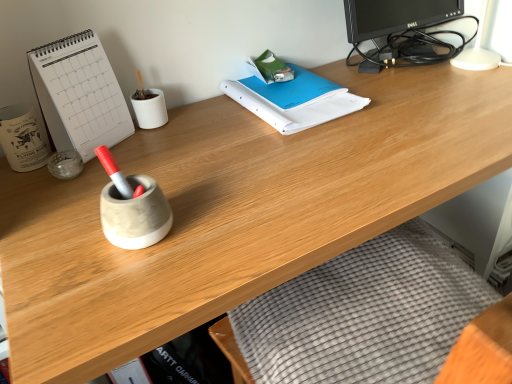
Identify the location of black glossy monitor at upper right. (401, 31).

This screenshot has height=384, width=512. What do you see at coordinates (401, 31) in the screenshot?
I see `black glossy monitor at upper right` at bounding box center [401, 31].

What is the approximate width of white paper at left?

white paper at left is 3.40 inches wide.

What is the approximate width of white ceramic mug at left, which appears as the second stationery when viewed from the right?

4.03 inches.

This screenshot has width=512, height=384. I want to click on blue paper binder at center, so click(294, 100).

Locate an element on the screen. This screenshot has height=384, width=512. black glossy monitor at upper right is located at coordinates pyautogui.click(x=401, y=31).

From a real-world perspective, which is physically above, transparent glass jar at left, arranged as the 1th stationery when viewed from the right, or blue paper binder at center?

From a 3D spatial view, blue paper binder at center is above.

You are a GUI agent. You are given a task and a screenshot of the screen. Output one action in this format:
    pyautogui.click(x=<x>, y=<y>)
    Task: Click on the 1st stationery to the left of the blue paper binder at center, counting from the anchor's position
    This screenshot has height=384, width=512.
    Given the screenshot: What is the action you would take?
    pyautogui.click(x=65, y=164)

From the image's perspective, which is below, transparent glass jar at left, arranged as the 1th stationery when viewed from the right, or blue paper binder at center?

transparent glass jar at left, arranged as the 1th stationery when viewed from the right.

Is transparent glass jar at left, arranged as the 1th stationery when viewed from the right, touching blue paper binder at center?

They are not placed beside each other.

Measure the distance between black glossy monitor at upper right and blue paper binder at center.

The distance of black glossy monitor at upper right from blue paper binder at center is 11.90 inches.

Is the surface of black glossy monitor at upper right in direct contact with blue paper binder at center?

black glossy monitor at upper right and blue paper binder at center are not in contact.

At what (x,y) coordinates should I click in order to perform the action: click on desktop computer behind the blue paper binder at center. Please return your answer as a coordinate pair (x, y). The image size is (512, 384). Looking at the image, I should click on (401, 31).

Which object is more forward, black glossy monitor at upper right or blue paper binder at center?

blue paper binder at center is closer to the camera.

Considering the sizes of objects white ceramic mug at left, marked as the first stationery in a left-to-right arrangement, and white paper at left in the image provided, who is smaller, white ceramic mug at left, marked as the first stationery in a left-to-right arrangement, or white paper at left?

white ceramic mug at left, marked as the first stationery in a left-to-right arrangement, is smaller.

Based on their positions, is white ceramic mug at left, marked as the first stationery in a left-to-right arrangement, located to the left or right of white paper at left?

white ceramic mug at left, marked as the first stationery in a left-to-right arrangement, is positioned on white paper at left's left side.

Between white ceramic mug at left, marked as the first stationery in a left-to-right arrangement, and white paper at left, which one has smaller width?

white paper at left is thinner.

From the image's perspective, which one is positioned lower, transparent glass jar at left, which appears as the second stationery when viewed from the left, or white ceramic mug at left, which appears as the second stationery when viewed from the right?

transparent glass jar at left, which appears as the second stationery when viewed from the left, appears lower in the image.

Looking at this image, is transparent glass jar at left, which appears as the second stationery when viewed from the left, further to camera compared to white ceramic mug at left, marked as the first stationery in a left-to-right arrangement?

Yes, it is.

Is transparent glass jar at left, which appears as the second stationery when viewed from the left, turned away from white ceramic mug at left, marked as the first stationery in a left-to-right arrangement?

No, white ceramic mug at left, marked as the first stationery in a left-to-right arrangement, is not at the back of transparent glass jar at left, which appears as the second stationery when viewed from the left.

Between transparent glass jar at left, which appears as the second stationery when viewed from the left, and white ceramic mug at left, which appears as the second stationery when viewed from the right, which one has smaller size?

Smaller between the two is transparent glass jar at left, which appears as the second stationery when viewed from the left.

Is white ceramic mug at left, which appears as the second stationery when viewed from the right, facing away from blue paper binder at center?

No, blue paper binder at center is not at the back of white ceramic mug at left, which appears as the second stationery when viewed from the right.

Consider the image. Which of these two, white ceramic mug at left, which appears as the second stationery when viewed from the right, or blue paper binder at center, is smaller?

white ceramic mug at left, which appears as the second stationery when viewed from the right.

From a real-world perspective, is white ceramic mug at left, marked as the first stationery in a left-to-right arrangement, positioned under blue paper binder at center based on gravity?

No, from a real-world perspective, white ceramic mug at left, marked as the first stationery in a left-to-right arrangement, is not below blue paper binder at center.

Is the depth of white ceramic mug at left, which appears as the second stationery when viewed from the right, less than that of black glossy monitor at upper right?

Yes, it is.

Is white ceramic mug at left, marked as the first stationery in a left-to-right arrangement, next to black glossy monitor at upper right?

They are not placed beside each other.

In the scene shown: Is white ceramic mug at left, marked as the first stationery in a left-to-right arrangement, oriented away from black glossy monitor at upper right?

white ceramic mug at left, marked as the first stationery in a left-to-right arrangement, is not turned away from black glossy monitor at upper right.

Between white ceramic mug at left, marked as the first stationery in a left-to-right arrangement, and black glossy monitor at upper right, which one appears on the left side from the viewer's perspective?

white ceramic mug at left, marked as the first stationery in a left-to-right arrangement, is more to the left.

The height and width of the screenshot is (384, 512). In the image, there is a white paper at left. In order to click on desktop computer below it (from a real-world perspective) in this screenshot , I will do `click(401, 31)`.

Choose the correct answer: Is white paper at left inside black glossy monitor at upper right or outside it?

white paper at left is outside black glossy monitor at upper right.

From the image's perspective, is white paper at left on top of black glossy monitor at upper right?

No, from the image's perspective, white paper at left is not over black glossy monitor at upper right.

Find the location of a particular element. Image resolution: width=512 pixels, height=384 pixels. the 2nd stationery positioned below the blue paper binder at center (from the image's perspective) is located at coordinates (65, 164).

Image resolution: width=512 pixels, height=384 pixels. I want to click on desktop computer on the right of the blue paper binder at center, so click(401, 31).

From the picture: When comparing their distances from white paper at left, does white ceramic mug at left, which appears as the second stationery when viewed from the right, or transparent glass jar at left, arranged as the 1th stationery when viewed from the right, seem closer?

white ceramic mug at left, which appears as the second stationery when viewed from the right, lies closer to white paper at left than the other object.

From the image, which object appears to be farther from white ceramic mug at left, which appears as the second stationery when viewed from the right, blue paper binder at center or black glossy monitor at upper right?

black glossy monitor at upper right is further to white ceramic mug at left, which appears as the second stationery when viewed from the right.

Looking at the image, which one is located further to black glossy monitor at upper right, transparent glass jar at left, arranged as the 1th stationery when viewed from the right, or white paper at left?

transparent glass jar at left, arranged as the 1th stationery when viewed from the right, is further to black glossy monitor at upper right.

Based on their spatial positions, is transparent glass jar at left, which appears as the second stationery when viewed from the left, or black glossy monitor at upper right further from white ceramic mug at left, marked as the first stationery in a left-to-right arrangement?

Based on the image, black glossy monitor at upper right appears to be further to white ceramic mug at left, marked as the first stationery in a left-to-right arrangement.

Which object lies further to the anchor point white paper at left, black glossy monitor at upper right or blue paper binder at center?

black glossy monitor at upper right is further to white paper at left.

Based on their spatial positions, is blue paper binder at center or white ceramic mug at left, which appears as the second stationery when viewed from the right, further from transparent glass jar at left, arranged as the 1th stationery when viewed from the right?

Based on the image, blue paper binder at center appears to be further to transparent glass jar at left, arranged as the 1th stationery when viewed from the right.

Estimate the real-world distances between objects in this image. Which object is closer to white ceramic mug at left, marked as the first stationery in a left-to-right arrangement, blue paper binder at center or transparent glass jar at left, arranged as the 1th stationery when viewed from the right?

transparent glass jar at left, arranged as the 1th stationery when viewed from the right, lies closer to white ceramic mug at left, marked as the first stationery in a left-to-right arrangement, than the other object.

Which object lies further to the anchor point blue paper binder at center, white paper at left or transparent glass jar at left, which appears as the second stationery when viewed from the left?

Among the two, transparent glass jar at left, which appears as the second stationery when viewed from the left, is located further to blue paper binder at center.

Image resolution: width=512 pixels, height=384 pixels. In order to click on stationery between white ceramic mug at left, which appears as the second stationery when viewed from the right, and black glossy monitor at upper right from left to right in this screenshot , I will do `click(65, 164)`.

You are a GUI agent. You are given a task and a screenshot of the screen. Output one action in this format:
    pyautogui.click(x=<x>, y=<y>)
    Task: Click on the stationery between white paper at left and transparent glass jar at left, which appears as the second stationery when viewed from the left, in the vertical direction
    
    Given the screenshot: What is the action you would take?
    [23, 138]

Where is `paperback book located between transparent glass jar at left, arranged as the 1th stationery when viewed from the right, and black glossy monitor at upper right in the left-right direction`? paperback book located between transparent glass jar at left, arranged as the 1th stationery when viewed from the right, and black glossy monitor at upper right in the left-right direction is located at coordinates (79, 94).

I want to click on notebook between white ceramic mug at left, marked as the first stationery in a left-to-right arrangement, and black glossy monitor at upper right, so click(x=294, y=100).